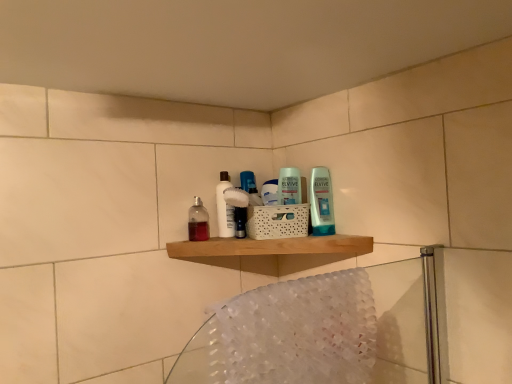
Question: From the image's perspective, is white glossy bottle at center on translucent plastic bottle at center?

Choices:
 (A) yes
 (B) no

Answer: (A)

Question: Is the depth of white glossy bottle at center greater than that of translucent plastic bottle at center?

Choices:
 (A) no
 (B) yes

Answer: (B)

Question: From a real-world perspective, does white glossy bottle at center stand above translucent plastic bottle at center?

Choices:
 (A) yes
 (B) no

Answer: (A)

Question: Is translucent plastic bottle at center surrounded by white glossy bottle at center?

Choices:
 (A) yes
 (B) no

Answer: (B)

Question: Would you consider white glossy bottle at center to be distant from translucent plastic bottle at center?

Choices:
 (A) no
 (B) yes

Answer: (A)

Question: From a real-world perspective, is translucent fabric bath towel at lower right physically located above or below translucent plastic bottle at center?

Choices:
 (A) above
 (B) below

Answer: (B)

Question: Would you say translucent fabric bath towel at lower right is to the left or to the right of translucent plastic bottle at center in the picture?

Choices:
 (A) left
 (B) right

Answer: (B)

Question: From their relative heights in the image, would you say translucent fabric bath towel at lower right is taller or shorter than translucent plastic bottle at center?

Choices:
 (A) short
 (B) tall

Answer: (B)

Question: Relative to translucent plastic bottle at center, is translucent fabric bath towel at lower right in front or behind?

Choices:
 (A) front
 (B) behind

Answer: (A)

Question: Considering the relative positions of translucent fabric bath towel at lower right and wooden shelf at center in the image provided, is translucent fabric bath towel at lower right to the left or to the right of wooden shelf at center?

Choices:
 (A) right
 (B) left

Answer: (A)

Question: In the image, is translucent fabric bath towel at lower right positioned in front of or behind wooden shelf at center?

Choices:
 (A) behind
 (B) front

Answer: (B)

Question: From a real-world perspective, is translucent fabric bath towel at lower right physically located above or below wooden shelf at center?

Choices:
 (A) above
 (B) below

Answer: (B)

Question: Is point (369, 284) closer or farther from the camera than point (317, 238)?

Choices:
 (A) closer
 (B) farther

Answer: (A)

Question: Is point (286, 244) positioned closer to the camera than point (195, 216)?

Choices:
 (A) closer
 (B) farther

Answer: (A)

Question: In terms of height, does wooden shelf at center look taller or shorter compared to translucent plastic bottle at center?

Choices:
 (A) short
 (B) tall

Answer: (A)